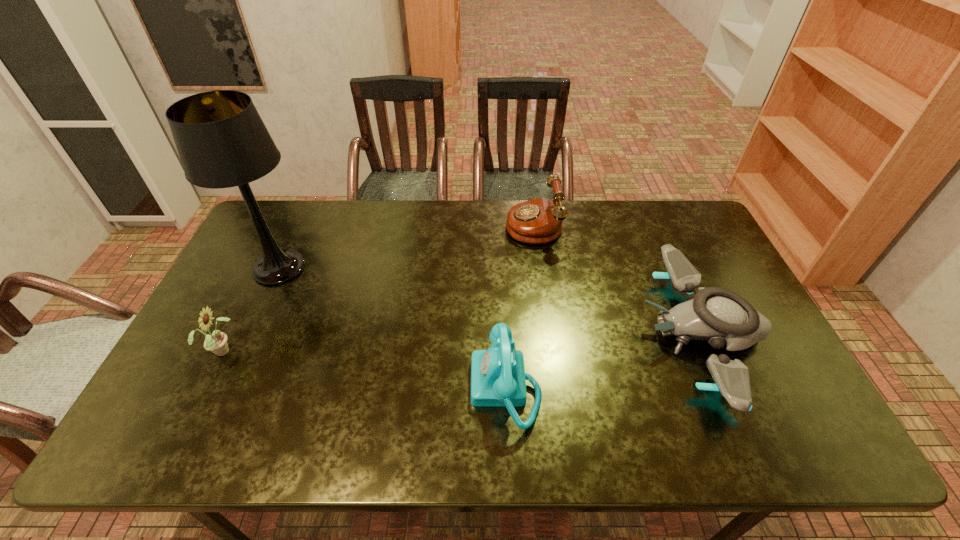
Where is `free space between the sunflower and the taller telephone`? The height and width of the screenshot is (540, 960). free space between the sunflower and the taller telephone is located at coordinates (377, 287).

I want to click on vacant space that is in between the farther telephone and the tallest object, so click(406, 246).

Find the location of a particular element. This screenshot has height=540, width=960. free space between the taller telephone and the tallest object is located at coordinates (406, 246).

Identify the location of free space between the shortest object and the tallest object. Image resolution: width=960 pixels, height=540 pixels. (491, 301).

Locate an element on the screen. unoccupied area between the farther telephone and the table lamp is located at coordinates (406, 246).

Where is `free space that is in between the tallest object and the sunflower`? The height and width of the screenshot is (540, 960). free space that is in between the tallest object and the sunflower is located at coordinates (251, 309).

This screenshot has height=540, width=960. In order to click on vacant space in between the tallest object and the farther telephone in this screenshot , I will do `click(406, 246)`.

Find the location of `free area in between the sunflower and the table lamp`. free area in between the sunflower and the table lamp is located at coordinates (251, 309).

Identify the location of vacant area that lies between the nearer telephone and the table lamp. Image resolution: width=960 pixels, height=540 pixels. (393, 328).

This screenshot has width=960, height=540. What are the coordinates of `free space that is in between the shortest object and the tallest object` in the screenshot? It's located at (491, 301).